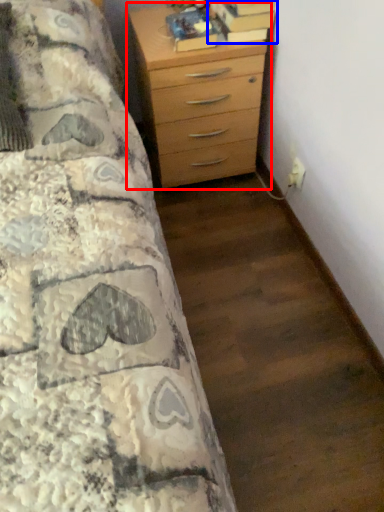
Question: Which of the following is the closest to the observer, chest of drawers (highlighted by a red box) or book (highlighted by a blue box)?

Choices:
 (A) chest of drawers
 (B) book

Answer: (A)